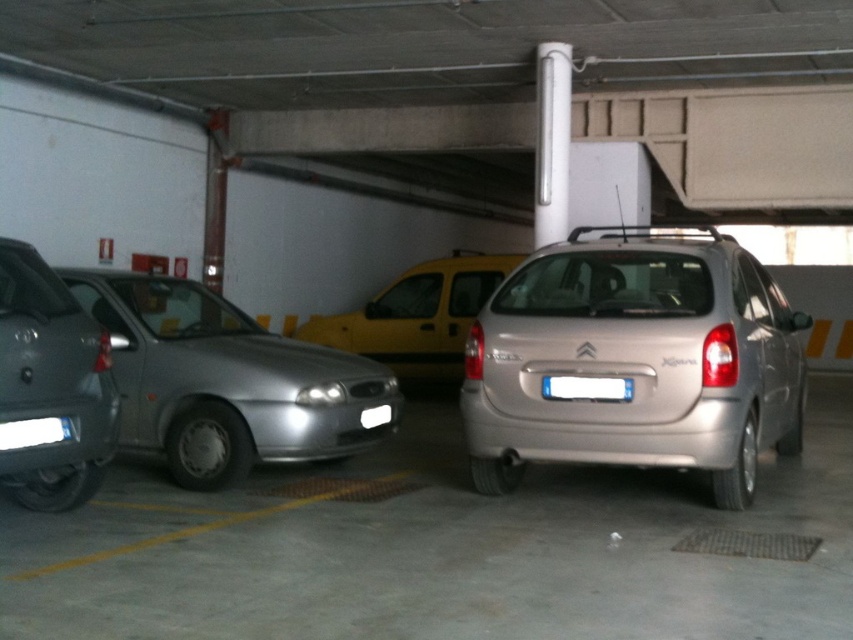
Can you confirm if satin gold hatchback at center is wider than silver metallic hatchback at left?

Yes, satin gold hatchback at center is wider than silver metallic hatchback at left.

Between point (614, 422) and point (56, 276), which one is positioned behind?

Point (614, 422)

What are the coordinates of `satin gold hatchback at center` in the screenshot? It's located at (636, 360).

Between satin silver sedan at left and silver metallic hatchback at left, which one has more height?

Standing taller between the two is silver metallic hatchback at left.

Describe the element at coordinates (225, 381) in the screenshot. The height and width of the screenshot is (640, 853). I see `satin silver sedan at left` at that location.

Identify the location of satin silver sedan at left. (225, 381).

The height and width of the screenshot is (640, 853). I want to click on satin gold hatchback at center, so click(x=636, y=360).

Is satin gold hatchback at center to the left of white plastic license plate at center from the viewer's perspective?

In fact, satin gold hatchback at center is to the right of white plastic license plate at center.

Is point (788, 403) positioned behind point (572, 396)?

Yes, it is.

Where is `satin gold hatchback at center`? This screenshot has height=640, width=853. satin gold hatchback at center is located at coordinates (636, 360).